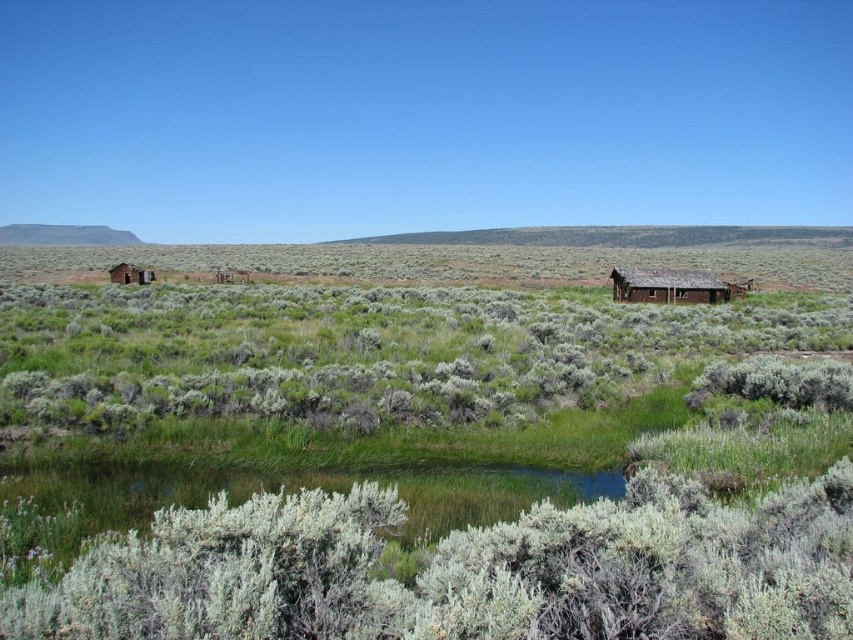
You are standing in the middle of the landscape and want to go to the nearest hut. Which one should you head towards, the weathered wood hut at right or the rustic wooden hut at left?

The weathered wood hut at right is below rustic wooden hut at left, so it is closer to you. You should head towards the weathered wood hut at right.

You are planning to set up a campsite and have two options for shelter. You see a weathered wood hut at right and a rustic wooden hut at left. Which one would you choose if you want a larger shelter?

The weathered wood hut at right is bigger than the rustic wooden hut at left, so you should choose the weathered wood hut at right for a larger shelter.